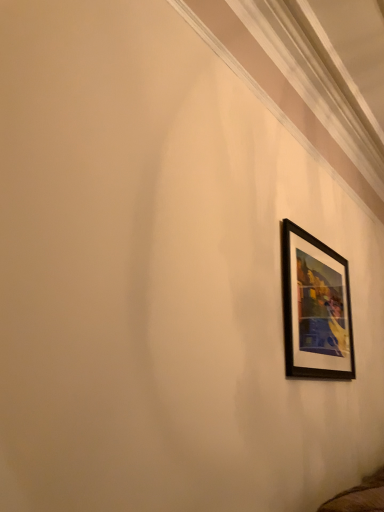
Image resolution: width=384 pixels, height=512 pixels. Describe the element at coordinates (315, 308) in the screenshot. I see `matte black picture frame at right` at that location.

I want to click on matte black picture frame at right, so click(315, 308).

Find the location of a particular element. This screenshot has width=384, height=512. matte black picture frame at right is located at coordinates (315, 308).